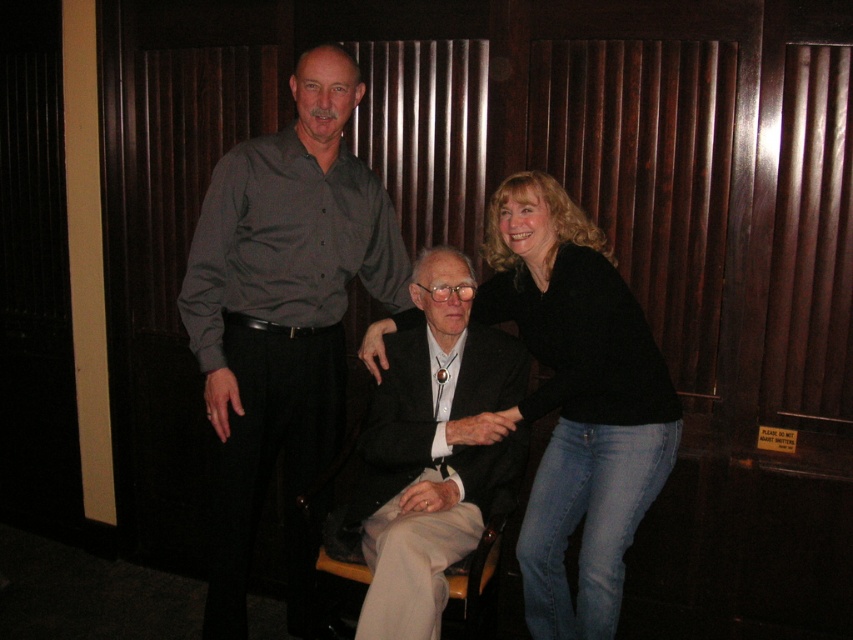
Is matte gray shirt at upper left thinner than black shirt at upper center?

Correct, matte gray shirt at upper left's width is less than black shirt at upper center's.

Which of these two, matte gray shirt at upper left or black shirt at upper center, stands taller?

black shirt at upper center is taller.

Find the location of `matte gray shirt at upper left`. matte gray shirt at upper left is located at coordinates (283, 316).

Identify the location of matte gray shirt at upper left. (283, 316).

Is point (300, 314) positioned before point (462, 500)?

No, it is not.

Which is behind, point (193, 284) or point (477, 422)?

The point (193, 284) is behind.

The height and width of the screenshot is (640, 853). What are the coordinates of `matte gray shirt at upper left` in the screenshot? It's located at (283, 316).

Between black shirt at upper center and black wool suit at center, which one has less height?

black wool suit at center is shorter.

Is point (300, 358) farther from camera compared to point (405, 410)?

Yes.

Which is behind, point (200, 230) or point (450, 381)?

Positioned behind is point (450, 381).

Find the location of `black shirt at upper center`. black shirt at upper center is located at coordinates (283, 314).